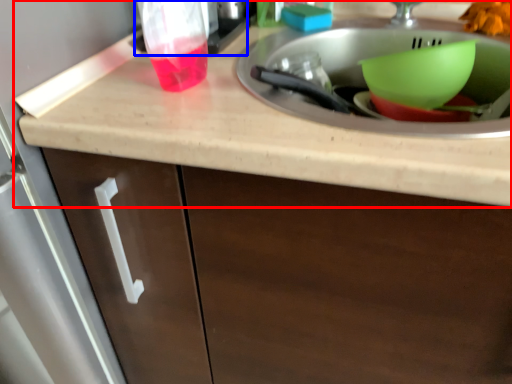
Question: Which object is further to the camera taking this photo, countertop (highlighted by a red box) or appliance (highlighted by a blue box)?

Choices:
 (A) countertop
 (B) appliance

Answer: (B)